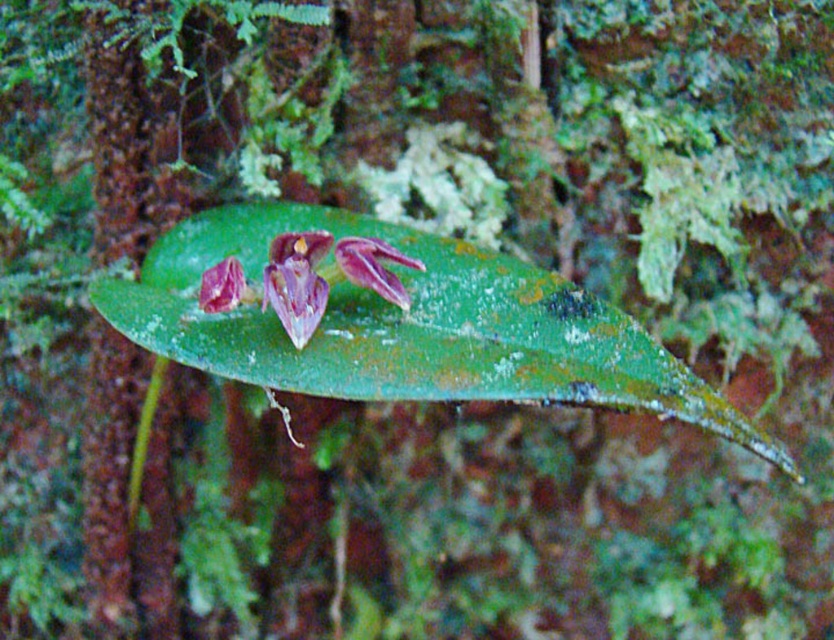
Can you confirm if purple matte flower at center is smaller than matte purple orchid at center?

No, purple matte flower at center is not smaller than matte purple orchid at center.

Which of these two, purple matte flower at center or matte purple orchid at center, stands taller?

purple matte flower at center

Is point (280, 259) closer to camera compared to point (199, 284)?

Yes, point (280, 259) is closer to viewer.

The height and width of the screenshot is (640, 834). I want to click on purple matte flower at center, so click(x=295, y=282).

From the picture: Which of these two, green matte leaf at center or purple matte orchid at center, stands shorter?

With less height is purple matte orchid at center.

Does green matte leaf at center have a smaller size compared to purple matte orchid at center?

No, green matte leaf at center is not smaller than purple matte orchid at center.

From the picture: Measure the distance between green matte leaf at center and camera.

green matte leaf at center is 1.12 meters away from camera.

This screenshot has height=640, width=834. In order to click on green matte leaf at center in this screenshot , I will do `click(409, 326)`.

Which is below, green matte leaf at center or purple matte flower at center?

green matte leaf at center is lower down.

Measure the distance between green matte leaf at center and camera.

green matte leaf at center is 3.68 feet from camera.

Locate an element on the screen. Image resolution: width=834 pixels, height=640 pixels. green matte leaf at center is located at coordinates (409, 326).